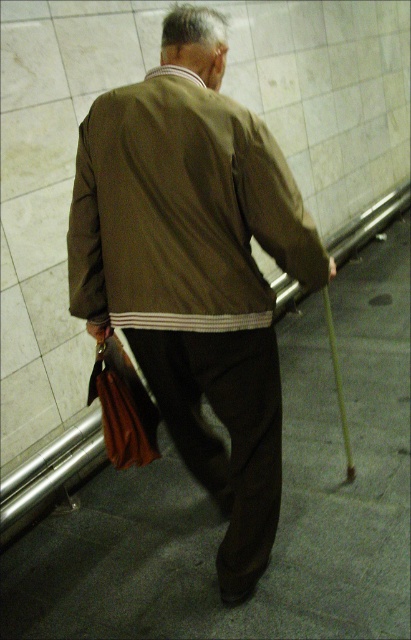
Question: Which point is closer to the camera?

Choices:
 (A) (221, 481)
 (B) (180, 280)

Answer: (B)

Question: Is brown fabric jacket at center further to the viewer compared to brown textured jacket at center?

Choices:
 (A) yes
 (B) no

Answer: (A)

Question: Among these points, which one is farthest from the camera?

Choices:
 (A) (143, 196)
 (B) (224, 556)

Answer: (B)

Question: Is brown fabric jacket at center further to camera compared to brown textured jacket at center?

Choices:
 (A) no
 (B) yes

Answer: (B)

Question: Does brown fabric jacket at center appear on the left side of brown textured jacket at center?

Choices:
 (A) yes
 (B) no

Answer: (B)